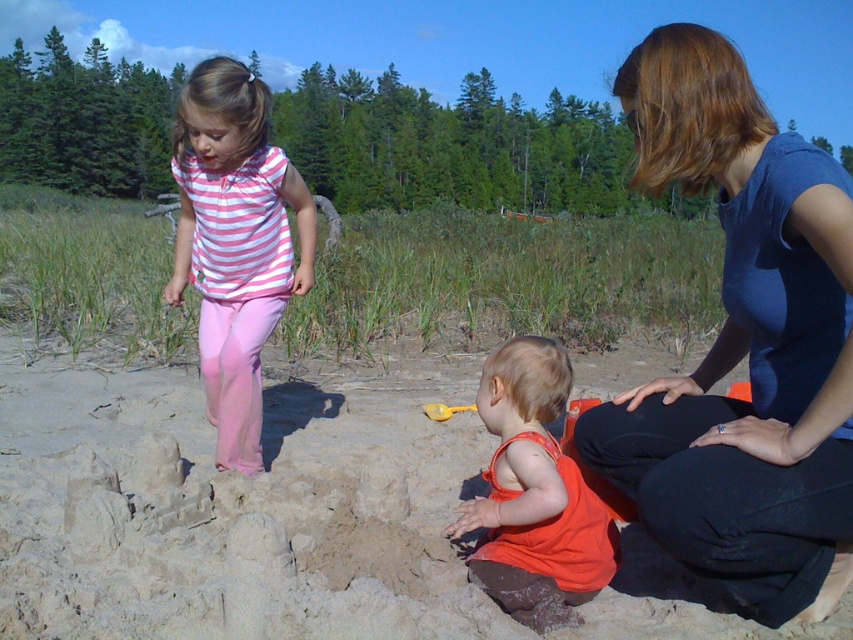
You are a photographer trying to capture a photo of the sandcastle. You notice the pink cotton pants at upper left and the yellow plastic shovel at center. Which object is wider so that it might block the view of the sandcastle if placed in front?

The pink cotton pants at upper left is wider than the yellow plastic shovel at center, so placing the pink cotton pants at upper left in front could block the view of the sandcastle more than the yellow plastic shovel at center.

You are standing at the origin point of the image. A pink cotton pants at upper left is located at coordinate point [235,243]. If you move 0.1 units to the right, will you be closer to or farther from the pink cotton pants at upper left?

Moving 0.1 units to the right from the origin point would increase your x coordinate from 0 to 0.1, while the pink cotton pants at upper left is at x 0.381. Since 0.1 is closer to 0.381 than 0 is, you would be closer to the pink cotton pants at upper left.

You are a photographer at the beach and want to capture a photo of the blue fabric dress at center and the orange fabric toddler at center. Based on their positions, which one should you focus on first to ensure both are in frame?

The blue fabric dress at center is above the orange fabric toddler at center, so you should focus on the orange fabric toddler at center first to ensure both are in frame.